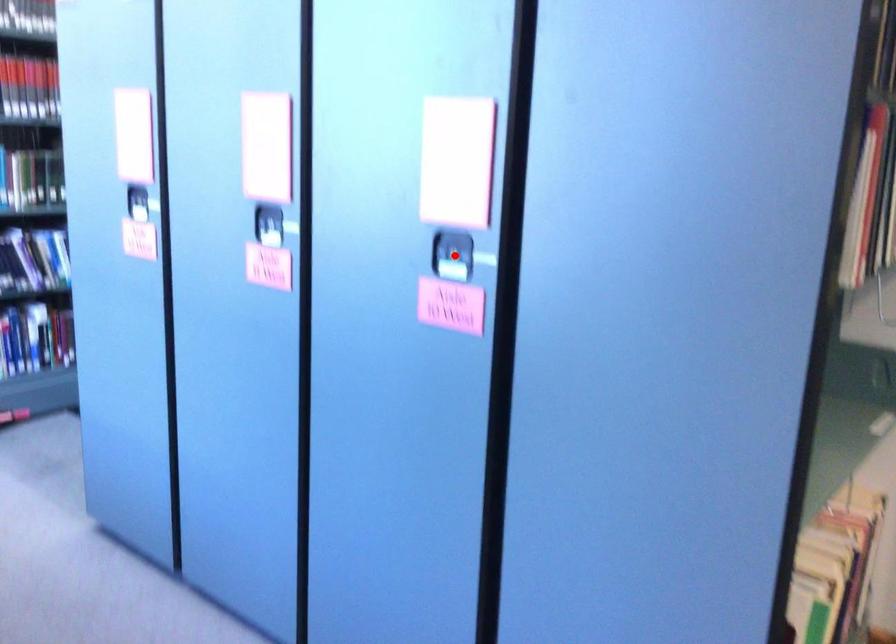
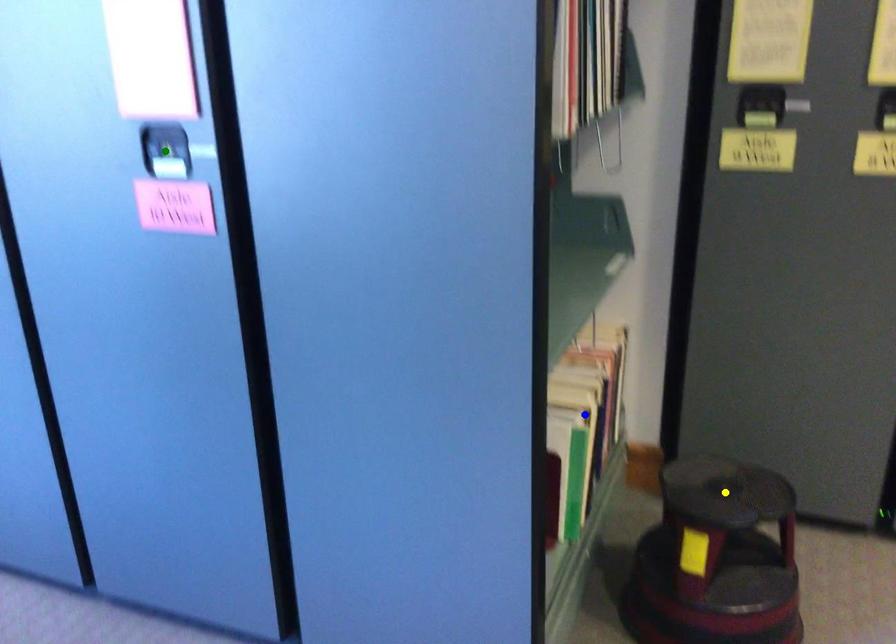
Question: I am providing you with two images of the same scene from different viewpoints. A red point is marked on the first image. You are given multiple points on the second image. Which spot in image 2 lines up with the point in image 1?

Choices:
 (A) blue point
 (B) green point
 (C) yellow point

Answer: (B)